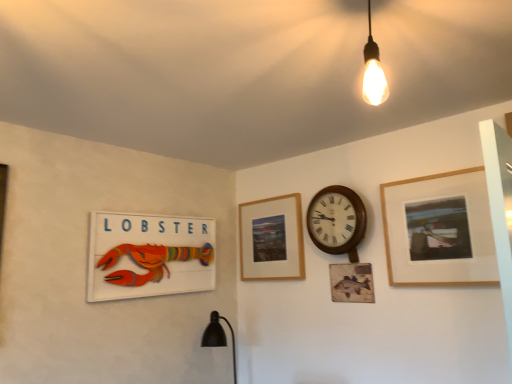
Question: From a real-world perspective, is wooden clock at center-right above or below wooden lobster sign at left, positioned as the 3th picture frame in right-to-left order?

Choices:
 (A) below
 (B) above

Answer: (B)

Question: Considering the positions of point (326, 193) and point (188, 218), is point (326, 193) closer or farther from the camera than point (188, 218)?

Choices:
 (A) closer
 (B) farther

Answer: (A)

Question: Estimate the real-world distances between objects in this image. Which object is farther from the wooden lobster sign at left, marked as the first picture frame in a left-to-right arrangement?

Choices:
 (A) wooden clock at center-right
 (B) wooden picture frame at center, which ranks as the 2th picture frame in left-to-right order
 (C) wooden frame at upper right, the first picture frame positioned from the right

Answer: (C)

Question: Which is farther from the wooden frame at upper right, the first picture frame positioned from the right?

Choices:
 (A) wooden clock at center-right
 (B) wooden picture frame at center, which ranks as the 2th picture frame in left-to-right order
 (C) wooden lobster sign at left, positioned as the 3th picture frame in right-to-left order

Answer: (C)